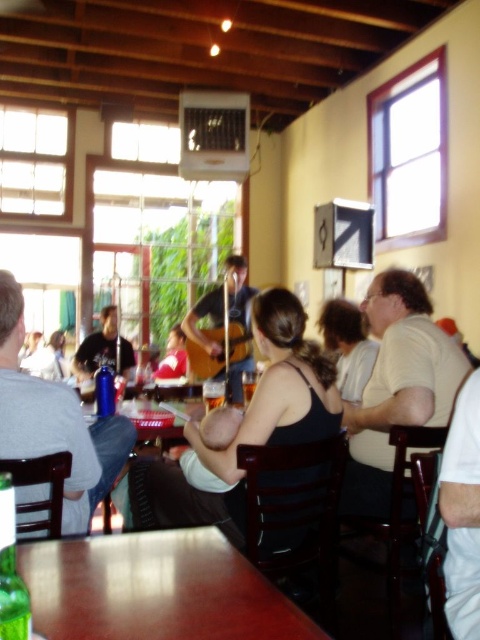
Can you confirm if matte black shirt at center is taller than matte red shirt at center?

Yes.

Is matte black shirt at center smaller than matte red shirt at center?

No.

Where is `matte black shirt at center`? This screenshot has width=480, height=640. matte black shirt at center is located at coordinates (104, 348).

Who is positioned more to the right, matte brown guitar at center or matte red shirt at center?

Positioned to the right is matte brown guitar at center.

Does matte brown guitar at center have a smaller size compared to matte red shirt at center?

Actually, matte brown guitar at center might be larger than matte red shirt at center.

Between point (201, 307) and point (177, 349), which one is positioned behind?

The point (177, 349) is behind.

This screenshot has height=640, width=480. Find the location of `matte brown guitar at center`. matte brown guitar at center is located at coordinates (210, 320).

Does point (105, 609) lie in front of point (228, 296)?

Yes, it is in front of point (228, 296).

Locate an element on the screen. The image size is (480, 640). brown wooden table at lower center is located at coordinates (155, 589).